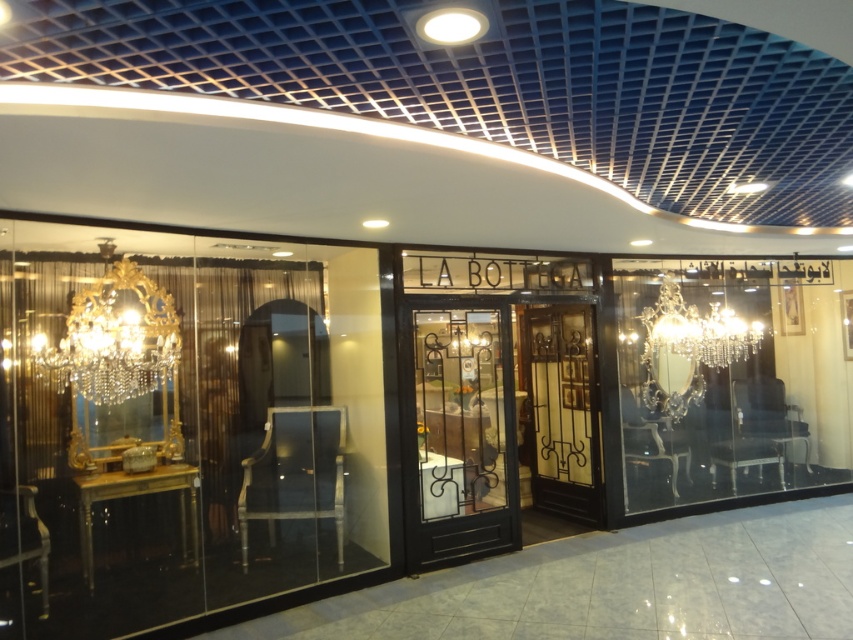
You are a customer entering LA BOTTECA and notice two chandeliers. The gold crystal chandelier at left and the clear crystal chandelier at center. Which one is hanging higher above the floor?

The clear crystal chandelier at center is hanging higher because the gold crystal chandelier at left is positioned under it.

You are a delivery person trying to enter the store through the black wrought iron door at center. There is a clear crystal chandelier at center in front of you. Can you walk through the space between the two objects without touching them?

→ The black wrought iron door at center occupies less space than the clear crystal chandelier at center, so there is enough space to walk through between them without touching either object.

Based on the photo, you are a delivery person carrying a package that requires a 5 meter clearance to pass through the store. You need to navigate between the gold crystal chandelier at left and the clear crystal chandelier at center. Can you safely pass through the space between them?

The gold crystal chandelier at left is 4.56 meters from the clear crystal chandelier at center. Since the required clearance is 5 meters, the distance between them is insufficient, so you cannot safely pass through the space between them.